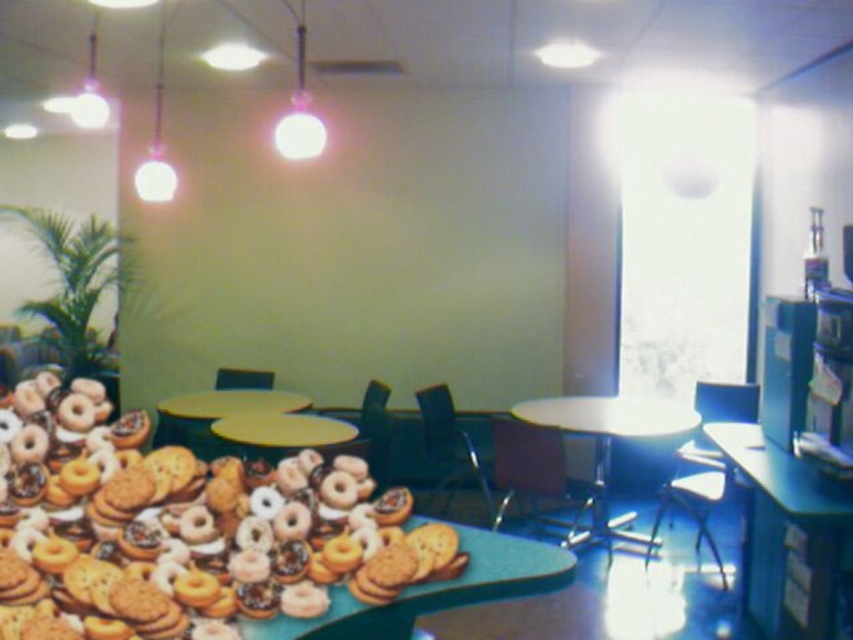
Question: Which point is farther to the camera?

Choices:
 (A) yellow plastic table at center
 (B) metallic blue table at lower right
 (C) yellow matte table at center

Answer: (A)

Question: Can you confirm if white glossy table at center is thinner than yellow matte table at center?

Choices:
 (A) no
 (B) yes

Answer: (A)

Question: Which of the following is the closest to the observer?

Choices:
 (A) (303, 403)
 (B) (682, 432)
 (C) (306, 422)

Answer: (B)

Question: Does yellow plastic table at center have a lesser width compared to yellow matte table at center?

Choices:
 (A) no
 (B) yes

Answer: (A)

Question: Which of the following is the closest to the observer?

Choices:
 (A) (264, 388)
 (B) (817, 605)

Answer: (B)

Question: Does yellow plastic table at center have a larger size compared to yellow matte table at center?

Choices:
 (A) yes
 (B) no

Answer: (A)